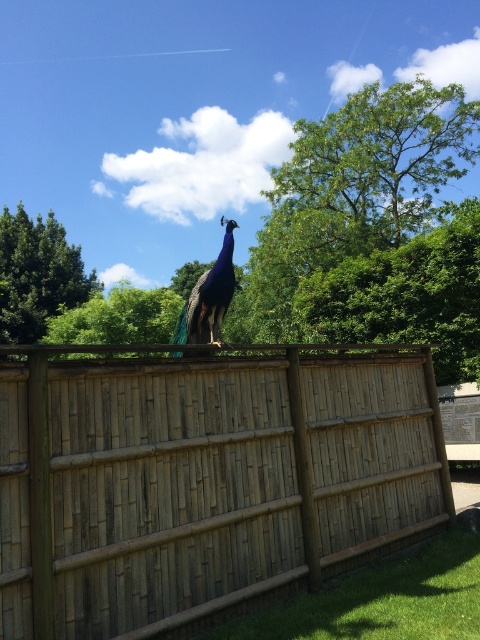
Question: Does brown wooden fence at center appear under green leafy tree at upper center?

Choices:
 (A) yes
 (B) no

Answer: (B)

Question: Which is farther from the shiny blue peacock at center?

Choices:
 (A) green leafy tree at upper left
 (B) green leafy tree at upper center
 (C) brown wooden fence at center

Answer: (A)

Question: Which object is farther from the camera taking this photo?

Choices:
 (A) green leafy tree at upper center
 (B) shiny blue peacock at center
 (C) green leafy tree at upper left
 (D) brown wooden fence at center

Answer: (C)

Question: Based on their relative distances, which object is farther from the brown wooden fence at center?

Choices:
 (A) shiny blue peacock at center
 (B) green leafy tree at upper center
 (C) green leafy tree at upper left

Answer: (C)

Question: Can you confirm if brown wooden fence at center is positioned to the left of green leafy tree at upper left?

Choices:
 (A) yes
 (B) no

Answer: (B)

Question: Is brown wooden fence at center above green leafy tree at upper center?

Choices:
 (A) no
 (B) yes

Answer: (B)